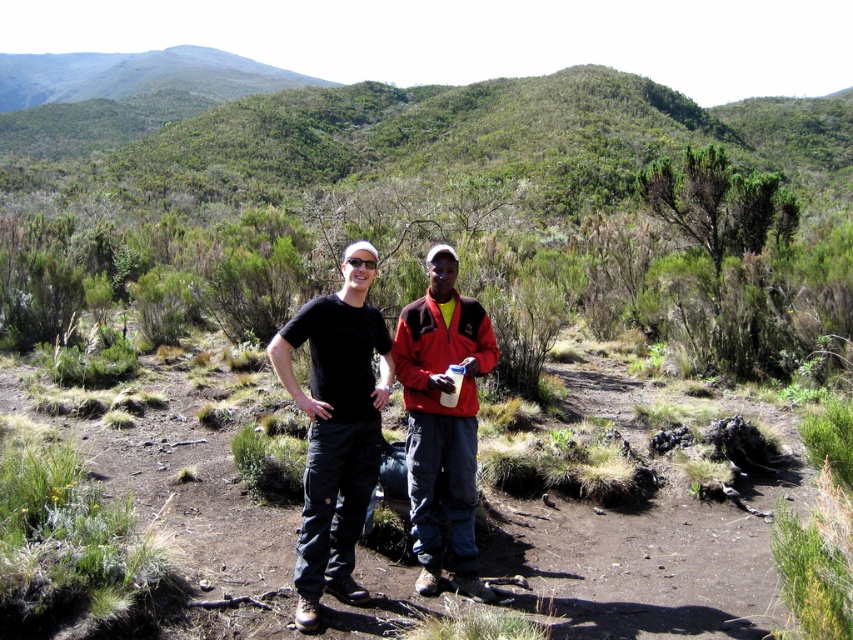
Question: In this image, where is black fabric pants at center located relative to red fleece jacket at center?

Choices:
 (A) above
 (B) below

Answer: (A)

Question: Which of the following is the farthest from the observer?

Choices:
 (A) red fleece jacket at center
 (B) black fabric pants at center

Answer: (A)

Question: Which point is closer to the camera?

Choices:
 (A) black fabric pants at center
 (B) red fleece jacket at center

Answer: (A)

Question: From the image, what is the correct spatial relationship of black fabric pants at center in relation to red fleece jacket at center?

Choices:
 (A) right
 (B) left

Answer: (B)

Question: Which object is farther from the camera taking this photo?

Choices:
 (A) black fabric pants at center
 (B) red fleece jacket at center

Answer: (B)

Question: Is black fabric pants at center to the right of red fleece jacket at center from the viewer's perspective?

Choices:
 (A) yes
 (B) no

Answer: (B)